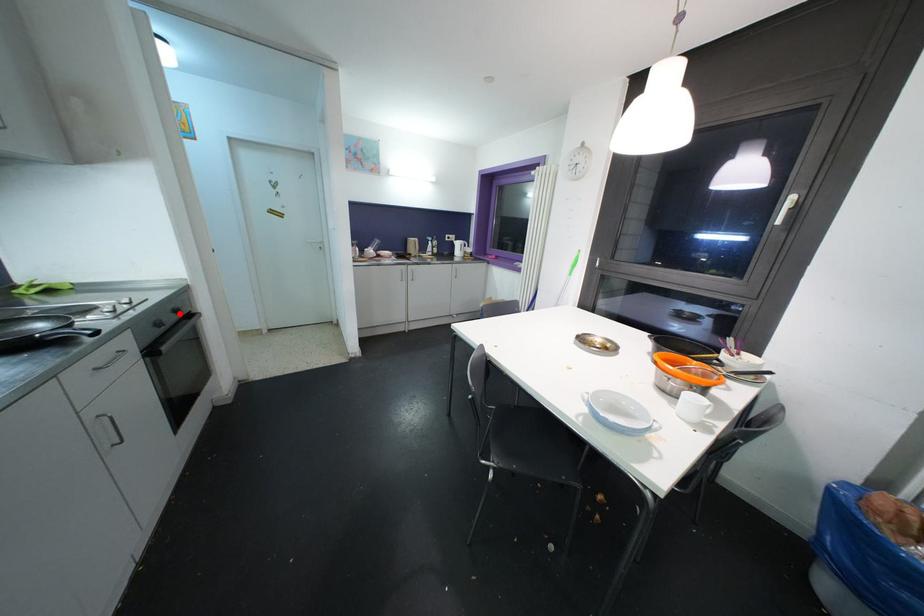
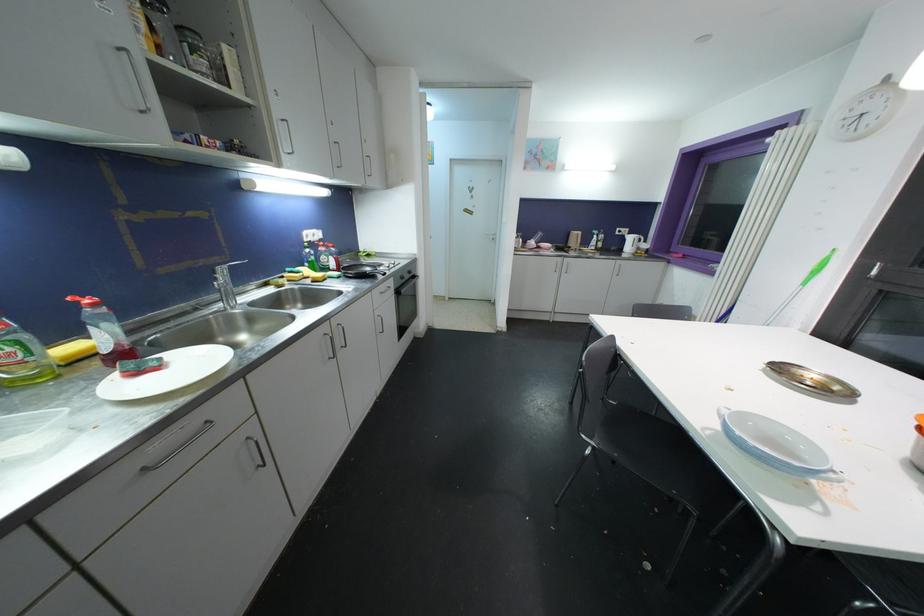
Question: I am providing you with two images of the same scene from different viewpoints. In image1, a red point is highlighted. Considering the same 3D point in image2, which of the following is correct?

Choices:
 (A) It is closer
 (B) It is farther

Answer: (A)